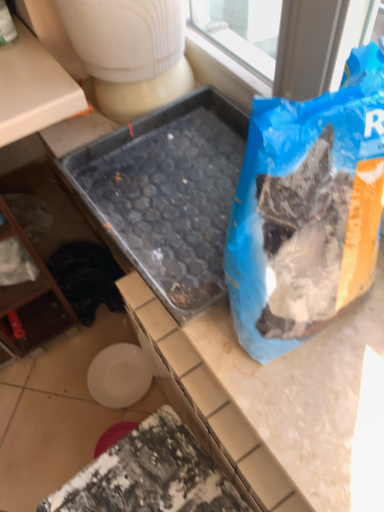
What do you see at coordinates (307, 210) in the screenshot? Image resolution: width=384 pixels, height=512 pixels. I see `blue plastic bag at upper right` at bounding box center [307, 210].

Find the location of a particular element. blue plastic bag at upper right is located at coordinates (307, 210).

In order to click on blue plastic bag at upper right in this screenshot , I will do tap(307, 210).